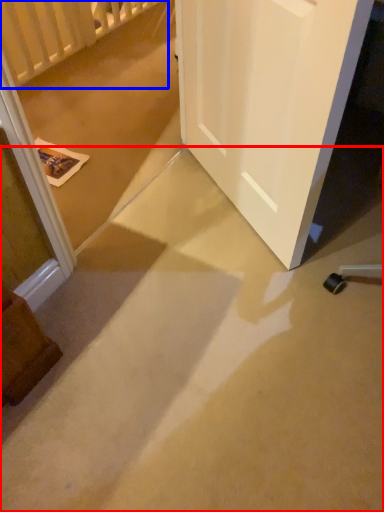
Question: Which object appears farthest to the camera in this image, concrete (highlighted by a red box) or balustrade (highlighted by a blue box)?

Choices:
 (A) concrete
 (B) balustrade

Answer: (B)